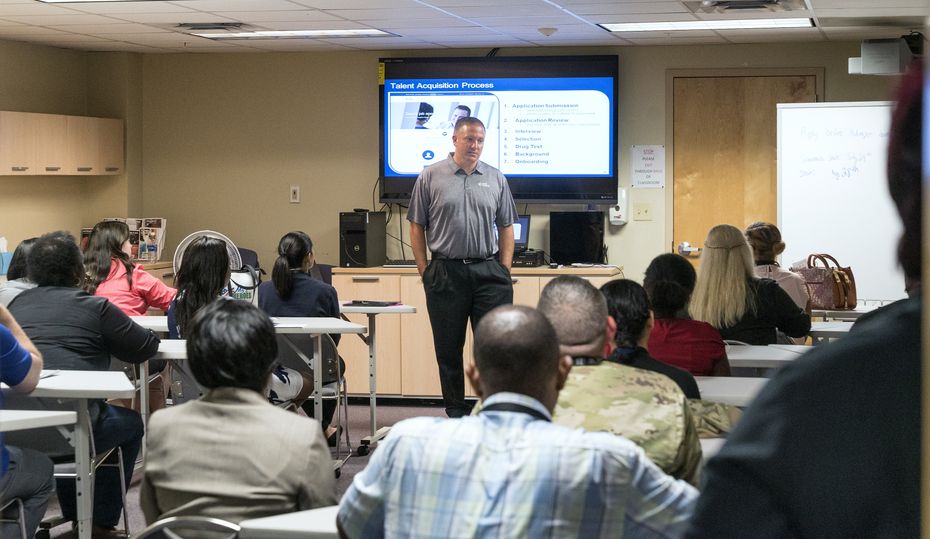
Identify the location of whiteboard. Image resolution: width=930 pixels, height=539 pixels. (847, 194).